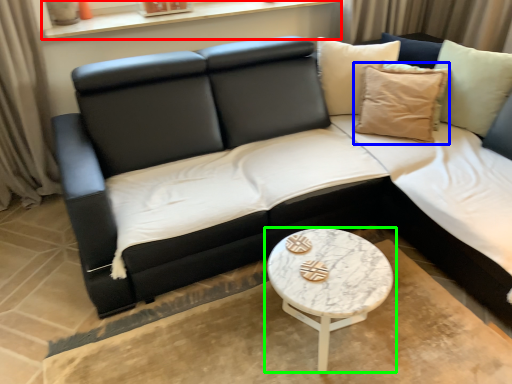
Question: Which object is the closest to the window sill (highlighted by a red box)? Choose among these: pillow (highlighted by a blue box) or coffee table (highlighted by a green box).

Choices:
 (A) pillow
 (B) coffee table

Answer: (A)